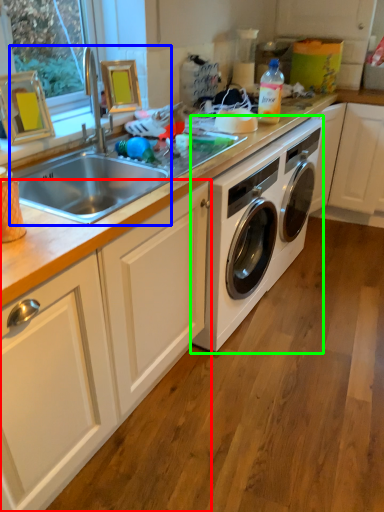
Question: Which is farther away from cabinetry (highlighted by a red box)? sink (highlighted by a blue box) or washing machine (highlighted by a green box)?

Choices:
 (A) sink
 (B) washing machine

Answer: (B)